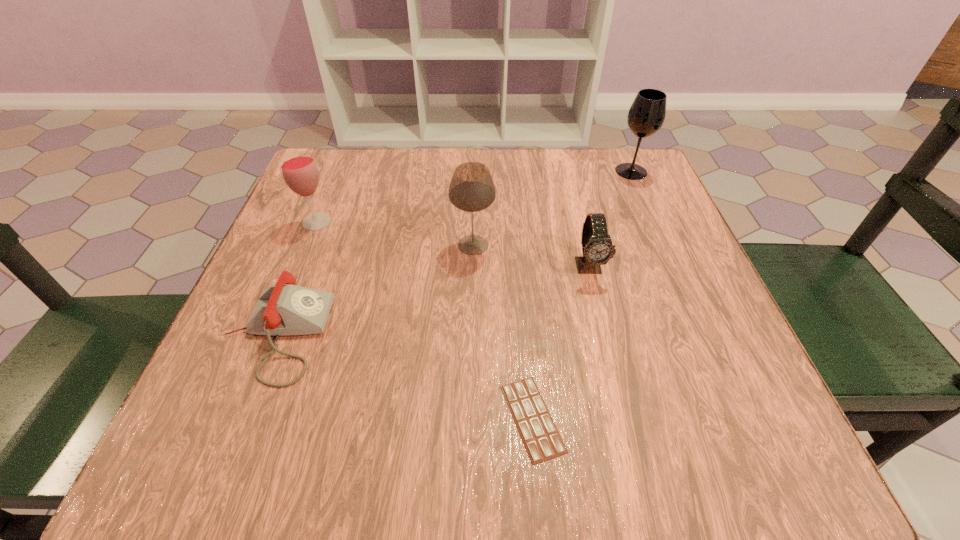
This screenshot has height=540, width=960. Find the location of `object that is at the far right corner`. object that is at the far right corner is located at coordinates (646, 116).

In the image, there is a desktop. Where is `free region at the far edge`? free region at the far edge is located at coordinates (533, 172).

This screenshot has width=960, height=540. In the image, there is a desktop. What are the coordinates of `free space at the left edge` in the screenshot? It's located at (279, 401).

In the image, there is a desktop. Find the location of `vacant region at the right edge`. vacant region at the right edge is located at coordinates (646, 294).

The width and height of the screenshot is (960, 540). In order to click on blank area at the far left corner in this screenshot , I will do `click(334, 201)`.

Identify the location of vacant space at the far right corner of the desktop. Image resolution: width=960 pixels, height=540 pixels. (x=619, y=149).

Find the location of a particular element. Image resolution: width=960 pixels, height=540 pixels. vacant region at the near right corner of the desktop is located at coordinates (704, 423).

Where is `empty space between the third object from right to left and the second shortest object`? The width and height of the screenshot is (960, 540). empty space between the third object from right to left and the second shortest object is located at coordinates pos(404,377).

Where is `unoccupied position between the third shortest object and the farthest wineglass`? This screenshot has width=960, height=540. unoccupied position between the third shortest object and the farthest wineglass is located at coordinates (611, 219).

Locate an element on the screen. This screenshot has height=540, width=960. blank region between the second wineglass from left to right and the telephone is located at coordinates (374, 290).